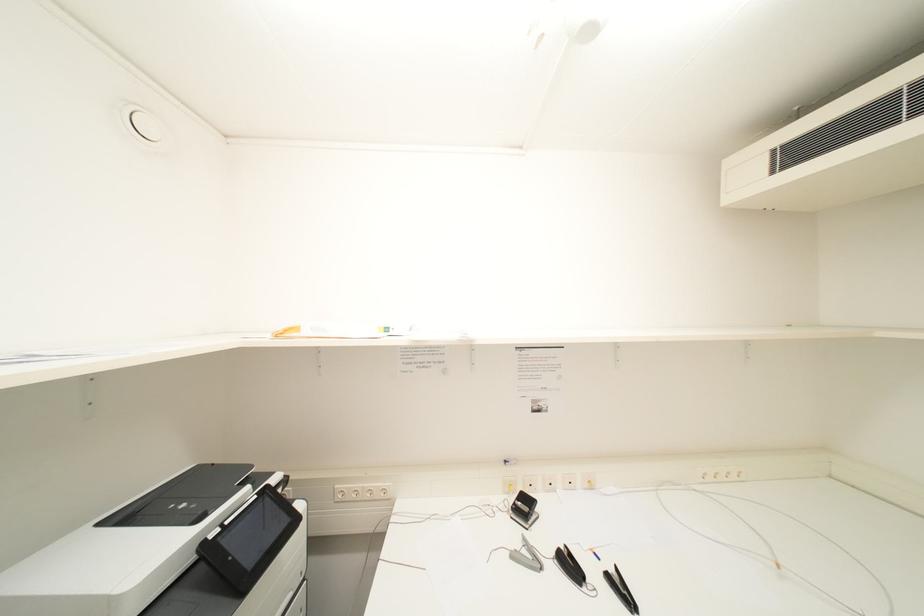
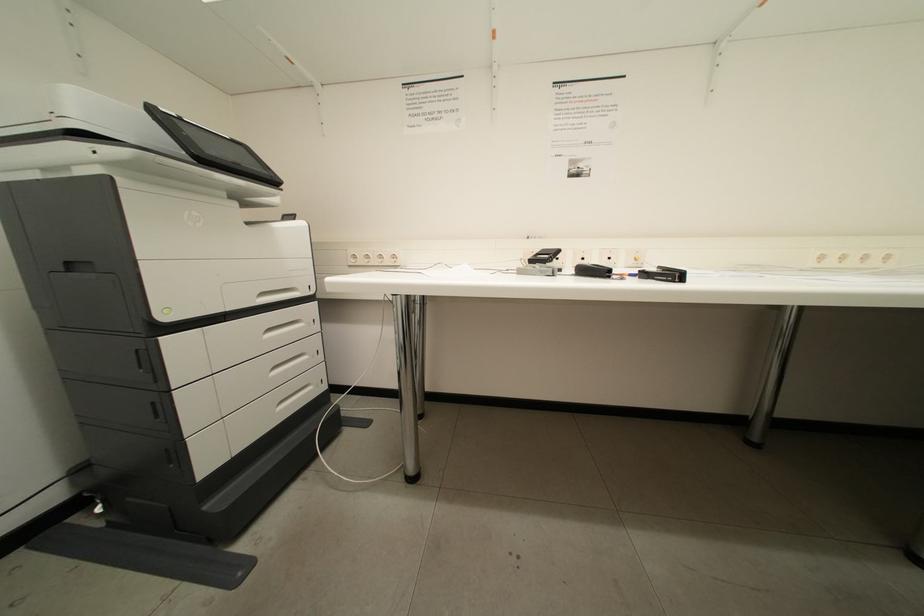
Question: The first image is from the beginning of the video and the second image is from the end. How did the camera likely rotate when shooting the video?

Choices:
 (A) Left
 (B) Right
 (C) Up
 (D) Down

Answer: (D)